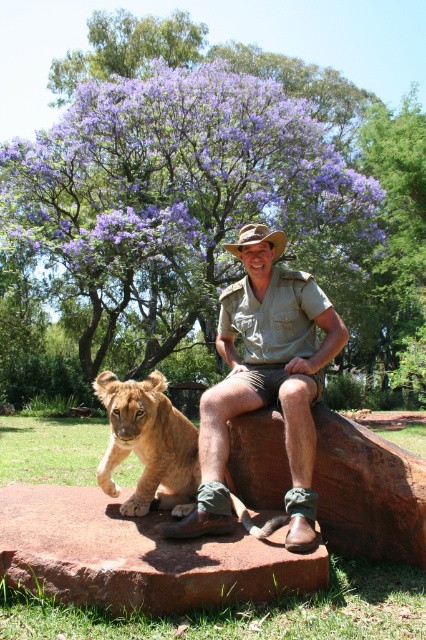
You are a photographer trying to capture both the purple leafy tree at upper center and the brown stone at lower center in your shot. Based on their sizes, which object will occupy more space in your photo?

The purple leafy tree at upper center will occupy more space in the photo because its width surpasses that of the brown stone at lower center.

You are a photographer wanting to capture both the purple leafy tree at upper center and the brown stone at lower center in the same frame. Which object should you position closer to the left side of your camera viewfinder to ensure both are visible?

To ensure both the purple leafy tree at upper center and the brown stone at lower center are visible in the frame, position the brown stone at lower center closer to the left side of your camera viewfinder since the purple leafy tree at upper center is on the right side of it.

You are standing at the point labeled as point (138, 556). What object are you standing on?

You are standing on the brown stone at lower center.